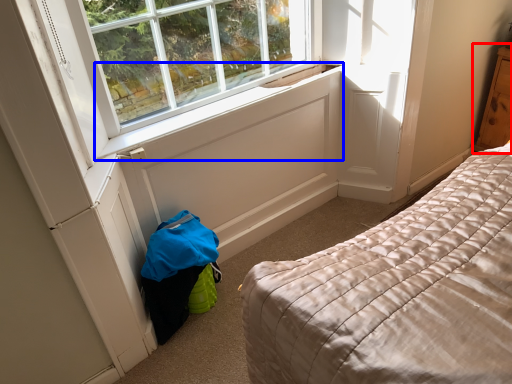
Question: Which point is further to the camera, dresser (highlighted by a red box) or window sill (highlighted by a blue box)?

Choices:
 (A) dresser
 (B) window sill

Answer: (A)